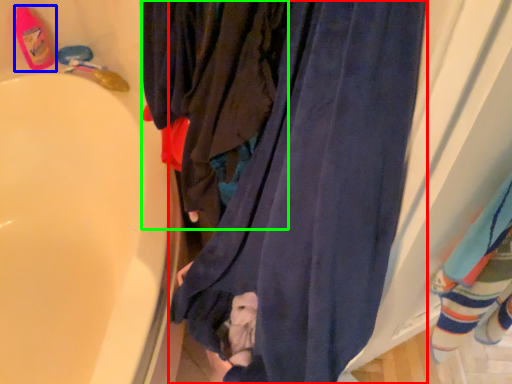
Question: Based on their relative distances, which object is nearer to curtain (highlighted by a red box)? Choose from footwear (highlighted by a blue box) and clothing (highlighted by a green box).

Choices:
 (A) footwear
 (B) clothing

Answer: (B)